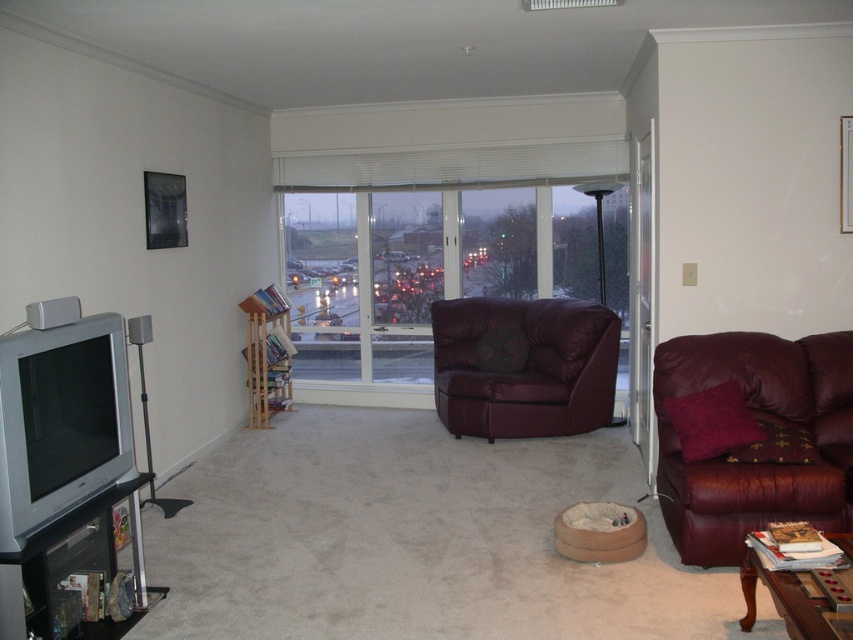
Question: Can you confirm if burgundy leather couch at right is positioned to the left of matte black tv stand at lower left?

Choices:
 (A) yes
 (B) no

Answer: (B)

Question: From the image, what is the correct spatial relationship of burgundy leather couch at right in relation to leather armchair at center?

Choices:
 (A) above
 (B) below

Answer: (B)

Question: Which point appears farthest from the camera in this image?

Choices:
 (A) (843, 536)
 (B) (631, 140)
 (C) (544, 321)

Answer: (C)

Question: Which point is farther from the camera taking this photo?

Choices:
 (A) (637, 397)
 (B) (78, 628)
 (C) (258, 340)
 (D) (350, 321)

Answer: (D)

Question: Where is burgundy leather couch at right located in relation to leather armchair at center in the image?

Choices:
 (A) left
 (B) right

Answer: (B)

Question: Which of the following is the farthest from the observer?

Choices:
 (A) (706, 525)
 (B) (433, 256)

Answer: (B)